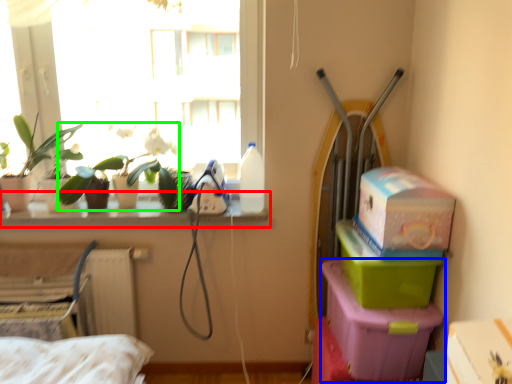
Question: Estimate the real-world distances between objects in this image. Which object is closer to window sill (highlighted by a red box), box (highlighted by a blue box) or plant (highlighted by a green box)?

Choices:
 (A) box
 (B) plant

Answer: (B)